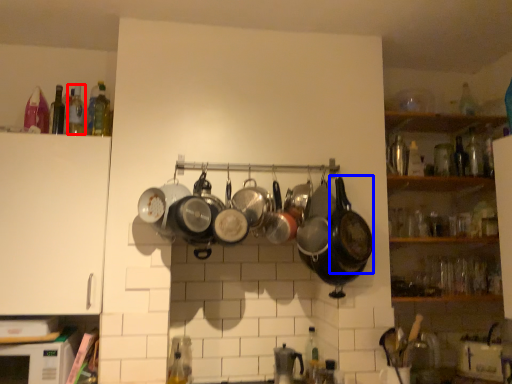
Question: Which of the following is the closest to the observer, bottle (highlighted by a red box) or wok (highlighted by a blue box)?

Choices:
 (A) bottle
 (B) wok

Answer: (B)